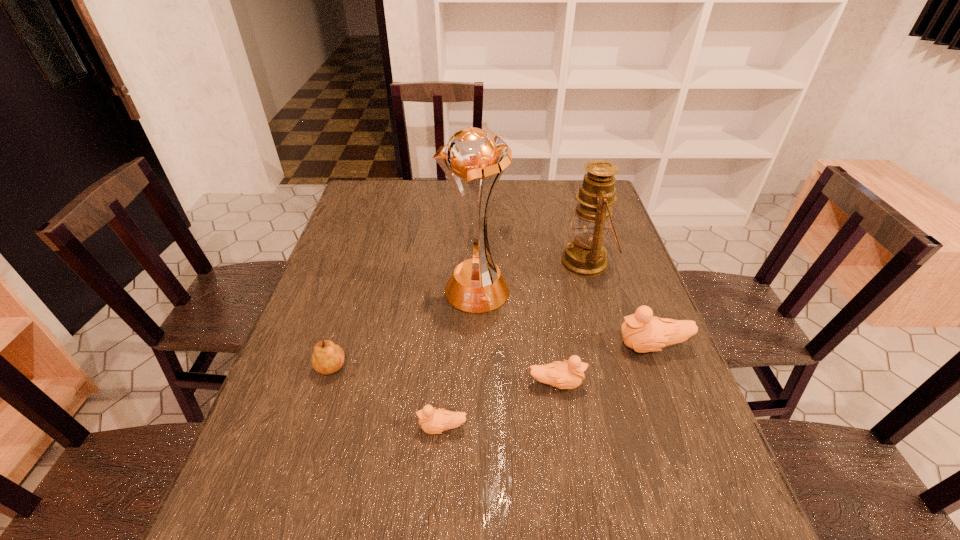
The width and height of the screenshot is (960, 540). What are the coordinates of `free spot between the oil lamp and the tallest object` in the screenshot? It's located at (531, 276).

Where is `vacant area that lies between the nearest duckling and the trophy`? This screenshot has width=960, height=540. vacant area that lies between the nearest duckling and the trophy is located at coordinates pos(459,359).

Locate an element on the screen. This screenshot has height=540, width=960. unoccupied position between the fifth shortest object and the fourth shortest object is located at coordinates (619, 305).

Image resolution: width=960 pixels, height=540 pixels. I want to click on free space between the trophy and the second nearest duckling, so click(516, 336).

You are a GUI agent. You are given a task and a screenshot of the screen. Output one action in this format:
    pyautogui.click(x=<x>, y=<y>)
    Task: Click on the free point between the second nearest duckling and the fourth shortest object
    Image resolution: width=960 pixels, height=540 pixels.
    Given the screenshot: What is the action you would take?
    pyautogui.click(x=604, y=365)

Locate an element on the screen. empty location between the oil lamp and the shortest duckling is located at coordinates (515, 345).

Where is `free space between the pear and the trophy`? free space between the pear and the trophy is located at coordinates (407, 329).

Where is `object identified as the closest to the tallest duckling`? object identified as the closest to the tallest duckling is located at coordinates (564, 375).

Where is `the closest object relative to the second duckling from right to left`? Image resolution: width=960 pixels, height=540 pixels. the closest object relative to the second duckling from right to left is located at coordinates (642, 332).

Select which duckling appears as the closest to the rightmost duckling. Please provide its 2D coordinates. Your answer should be formatted as a tuple, i.e. [(x, y)], where the tuple contains the x and y coordinates of a point satisfying the conditions above.

[(564, 375)]